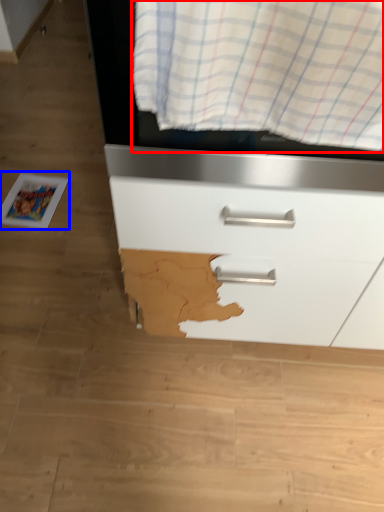
Question: Which of the following is the farthest to the observer, curtain (highlighted by a red box) or magazine (highlighted by a blue box)?

Choices:
 (A) curtain
 (B) magazine

Answer: (B)